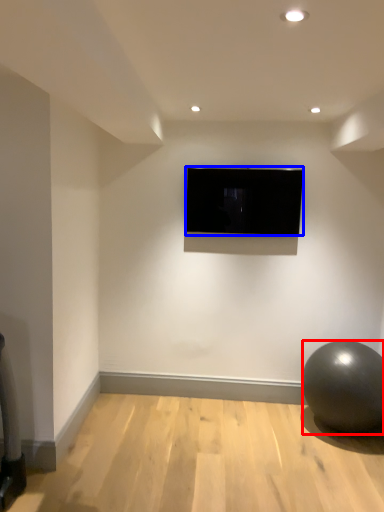
Question: Which object appears closest to the camera in this image, ball (highlighted by a red box) or television (highlighted by a blue box)?

Choices:
 (A) ball
 (B) television

Answer: (A)